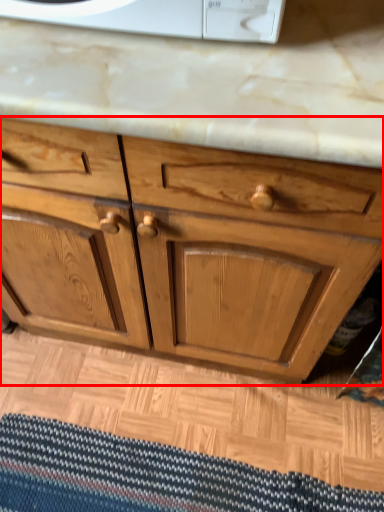
Question: In this image, where is chest of drawers (annotated by the red box) located relative to doormat?

Choices:
 (A) right
 (B) left

Answer: (A)